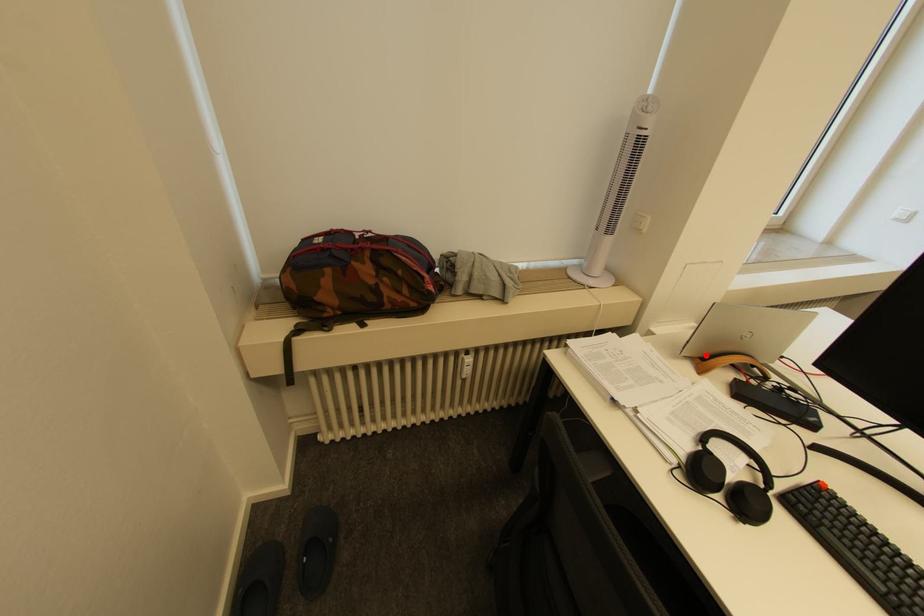
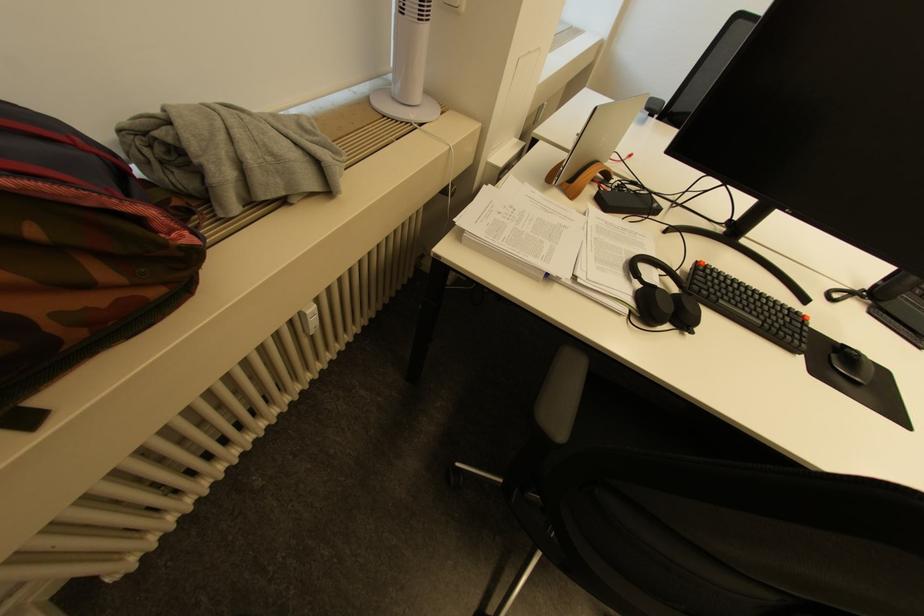
Where in the second image is the point corresponding to the highlighted location from the first image?

(574, 177)